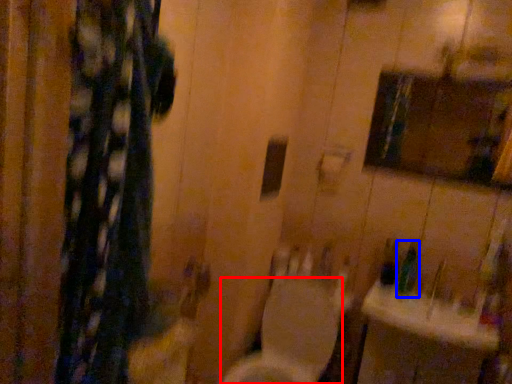
Question: Which of the following is the farthest to the observer, toilet (highlighted by a red box) or toiletry (highlighted by a blue box)?

Choices:
 (A) toilet
 (B) toiletry

Answer: (B)